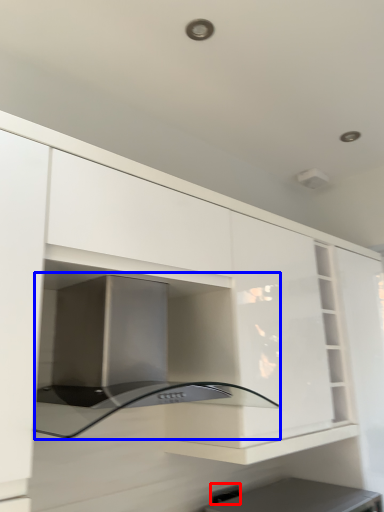
Question: Which of the following is the closest to the observer, electric outlet (highlighted by a red box) or oven (highlighted by a blue box)?

Choices:
 (A) electric outlet
 (B) oven

Answer: (B)